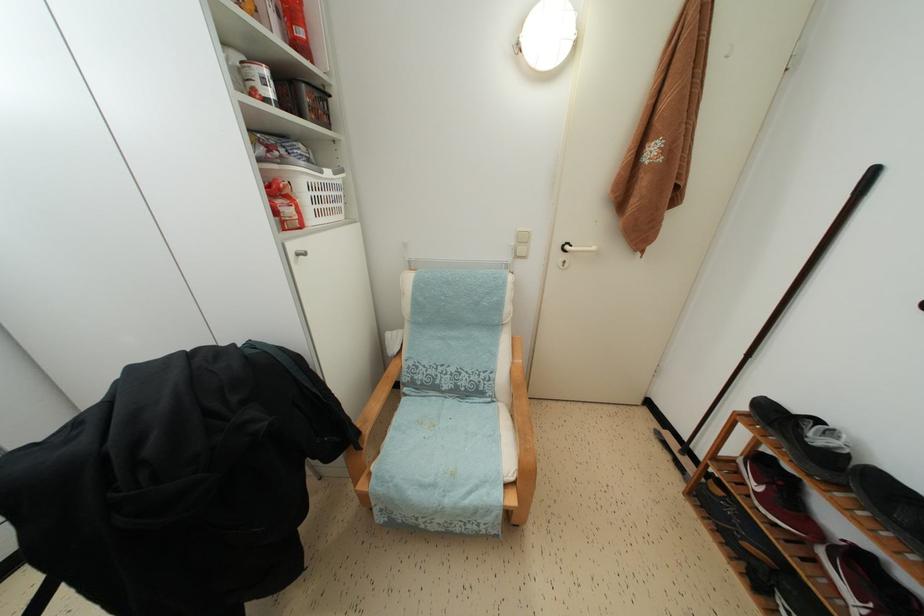
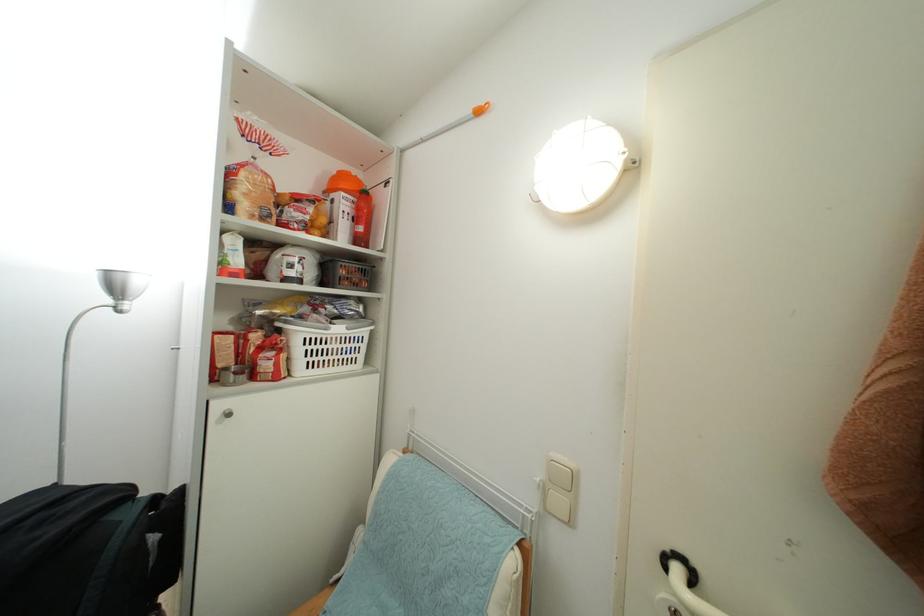
In the second image, find the point that corresponds to [305,38] in the first image.

(365, 235)